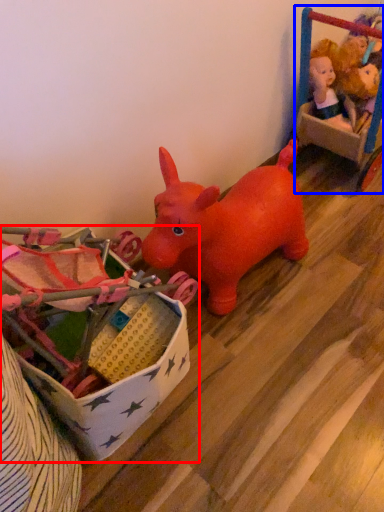
Question: Which object appears closest to the camera in this image, toy (highlighted by a red box) or toy (highlighted by a blue box)?

Choices:
 (A) toy
 (B) toy

Answer: (A)